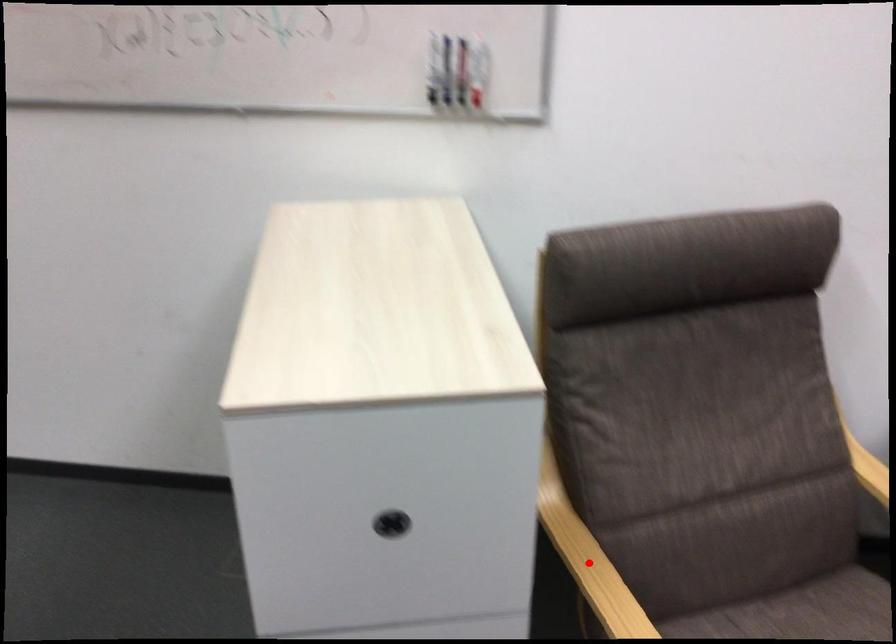
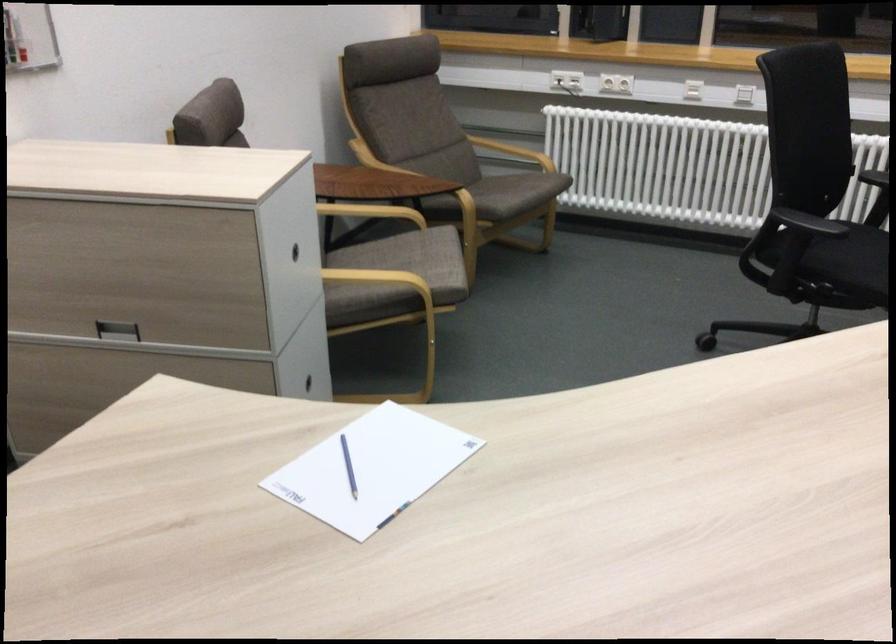
Question: I am providing you with two images of the same scene from different viewpoints. A red point is marked on the first image. Can you still see the location of the red point in image 2?

Choices:
 (A) Yes
 (B) No

Answer: (B)